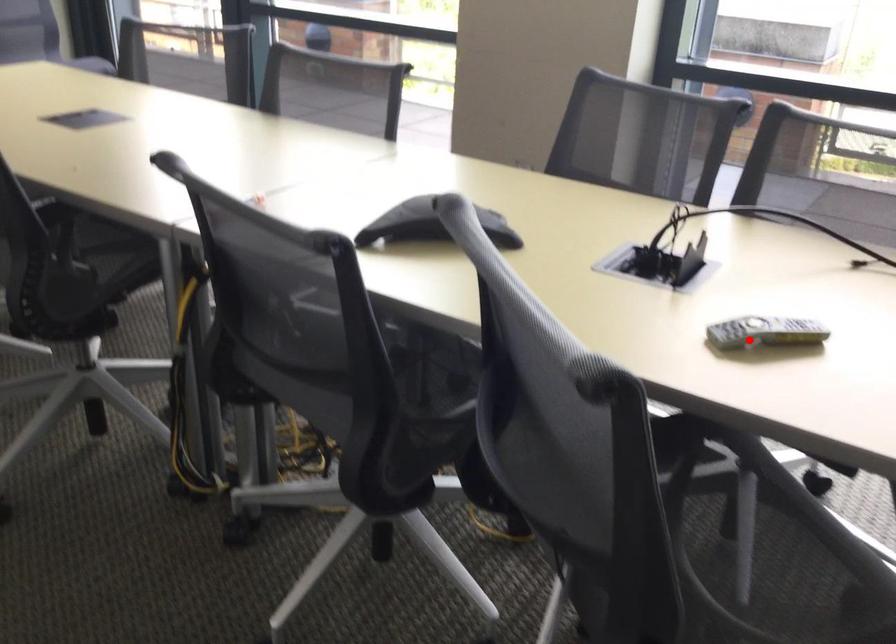
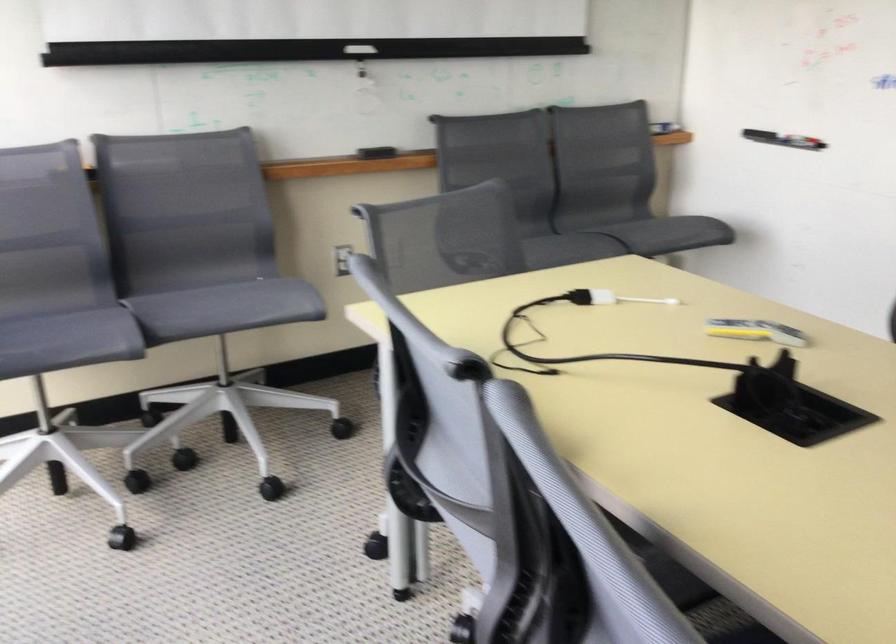
Question: A red point is marked in image1. In image2, is the corresponding 3D point closer to the camera or farther? Reply with the corresponding letter.

Choices:
 (A) The corresponding 3D point is closer.
 (B) The corresponding 3D point is farther.

Answer: (B)